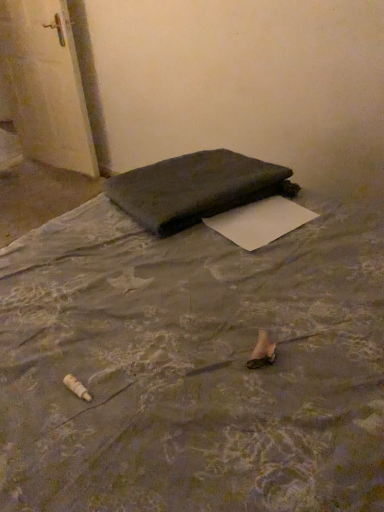
Question: Is the depth of dark fabric bag at center greater than that of white paper at center?

Choices:
 (A) yes
 (B) no

Answer: (A)

Question: Is white paper at center located within dark fabric bag at center?

Choices:
 (A) yes
 (B) no

Answer: (B)

Question: Is dark fabric bag at center to the left of white paper at center from the viewer's perspective?

Choices:
 (A) yes
 (B) no

Answer: (A)

Question: Can you confirm if dark fabric bag at center is wider than white paper at center?

Choices:
 (A) yes
 (B) no

Answer: (A)

Question: Does dark fabric bag at center lie in front of white paper at center?

Choices:
 (A) no
 (B) yes

Answer: (A)

Question: Is dark fabric bag at center completely or partially outside of white paper at center?

Choices:
 (A) yes
 (B) no

Answer: (A)

Question: From the image's perspective, is white glossy door at upper left under white paper at center?

Choices:
 (A) no
 (B) yes

Answer: (A)

Question: From a real-world perspective, does white glossy door at upper left stand above white paper at center?

Choices:
 (A) yes
 (B) no

Answer: (B)

Question: Is white glossy door at upper left outside white paper at center?

Choices:
 (A) no
 (B) yes

Answer: (B)

Question: Could you tell me if white glossy door at upper left is facing white paper at center?

Choices:
 (A) no
 (B) yes

Answer: (A)

Question: Is white glossy door at upper left beside white paper at center?

Choices:
 (A) yes
 (B) no

Answer: (B)

Question: Can you confirm if white glossy door at upper left is shorter than white paper at center?

Choices:
 (A) no
 (B) yes

Answer: (A)

Question: Considering the relative sizes of dark fabric bag at center and white glossy door at upper left in the image provided, is dark fabric bag at center smaller than white glossy door at upper left?

Choices:
 (A) no
 (B) yes

Answer: (B)